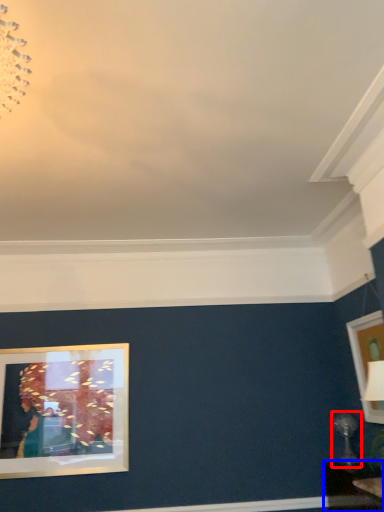
Question: Which object is further to the camera taking this photo, table lamp (highlighted by a red box) or table (highlighted by a blue box)?

Choices:
 (A) table lamp
 (B) table

Answer: (A)